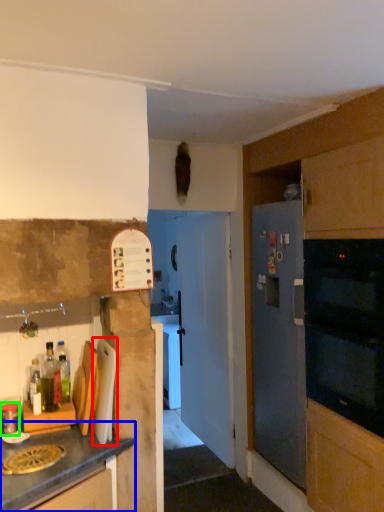
Question: Based on their relative distances, which object is nearer to appliance (highlighted by a red box)? Choose from cabinetry (highlighted by a blue box) and kitchen appliance (highlighted by a green box).

Choices:
 (A) cabinetry
 (B) kitchen appliance

Answer: (A)